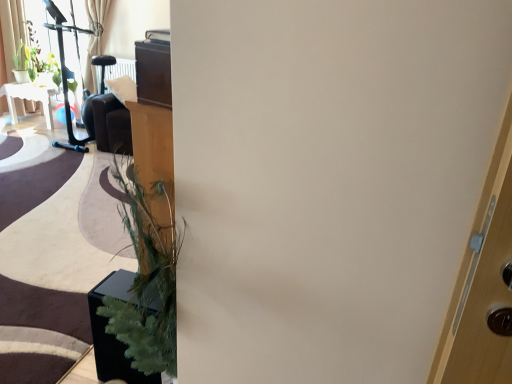
Question: Are green matte plant at upper left, the first plant in the right-to-left sequence, and green matte plant at upper left, the second plant positioned from the right, located far from each other?

Choices:
 (A) yes
 (B) no

Answer: (B)

Question: Considering the relative sizes of green matte plant at upper left, marked as the second plant in a left-to-right arrangement, and green matte plant at upper left, the second plant positioned from the right, in the image provided, is green matte plant at upper left, marked as the second plant in a left-to-right arrangement, taller than green matte plant at upper left, the second plant positioned from the right,?

Choices:
 (A) no
 (B) yes

Answer: (B)

Question: Is green matte plant at upper left, the first plant in the right-to-left sequence, positioned with its back to green matte plant at upper left, the second plant positioned from the right?

Choices:
 (A) yes
 (B) no

Answer: (B)

Question: From the image's perspective, is green matte plant at upper left, the first plant in the right-to-left sequence, below green matte plant at upper left, the second plant positioned from the right?

Choices:
 (A) yes
 (B) no

Answer: (A)

Question: Does green matte plant at upper left, the first plant in the right-to-left sequence, turn towards green matte plant at upper left, the first plant viewed from the left?

Choices:
 (A) yes
 (B) no

Answer: (B)

Question: Is green matte plant at upper left, marked as the second plant in a left-to-right arrangement, wider than green matte plant at upper left, the first plant viewed from the left?

Choices:
 (A) yes
 (B) no

Answer: (A)

Question: Considering the relative positions of light beige fabric curtain at upper left and green matte plant at upper left, the first plant viewed from the left, in the image provided, is light beige fabric curtain at upper left to the left of green matte plant at upper left, the first plant viewed from the left, from the viewer's perspective?

Choices:
 (A) no
 (B) yes

Answer: (B)

Question: Can you confirm if light beige fabric curtain at upper left is thinner than green matte plant at upper left, the first plant viewed from the left?

Choices:
 (A) no
 (B) yes

Answer: (A)

Question: Can you confirm if light beige fabric curtain at upper left is wider than green matte plant at upper left, the second plant positioned from the right?

Choices:
 (A) yes
 (B) no

Answer: (A)

Question: Is light beige fabric curtain at upper left facing towards green matte plant at upper left, the second plant positioned from the right?

Choices:
 (A) yes
 (B) no

Answer: (A)

Question: Considering the relative sizes of light beige fabric curtain at upper left and green matte plant at upper left, the first plant viewed from the left, in the image provided, is light beige fabric curtain at upper left bigger than green matte plant at upper left, the first plant viewed from the left,?

Choices:
 (A) yes
 (B) no

Answer: (A)

Question: Is light beige fabric curtain at upper left turned away from green matte plant at upper left, the first plant viewed from the left?

Choices:
 (A) yes
 (B) no

Answer: (A)

Question: Considering the relative sizes of light beige fabric curtain at upper left and white glossy table at upper left in the image provided, is light beige fabric curtain at upper left wider than white glossy table at upper left?

Choices:
 (A) yes
 (B) no

Answer: (B)